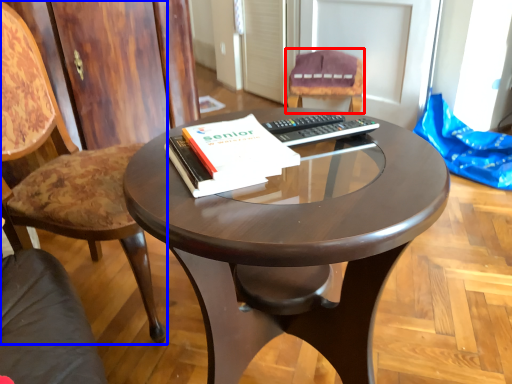
Question: Among these objects, which one is farthest to the camera, chair (highlighted by a red box) or chair (highlighted by a blue box)?

Choices:
 (A) chair
 (B) chair

Answer: (A)